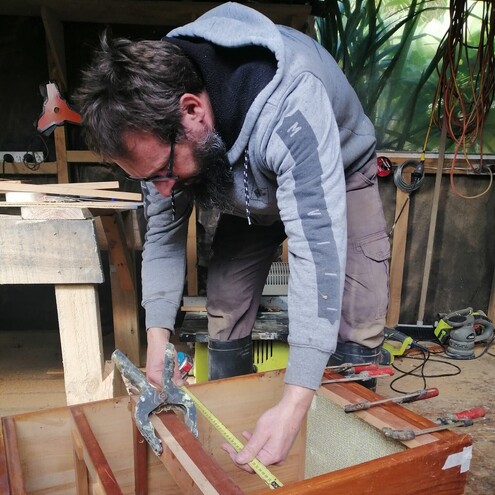
The height and width of the screenshot is (495, 495). I want to click on wood wall, so click(x=457, y=246).